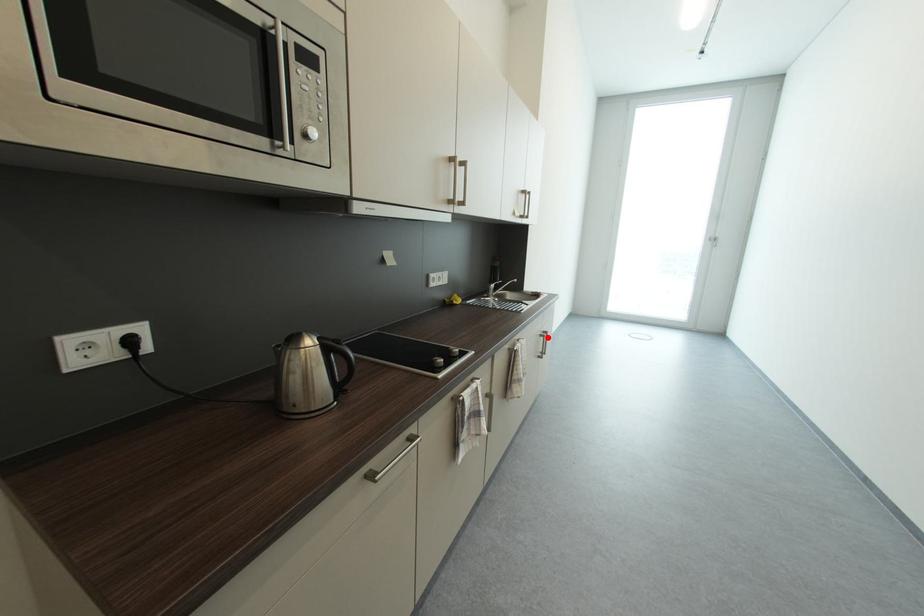
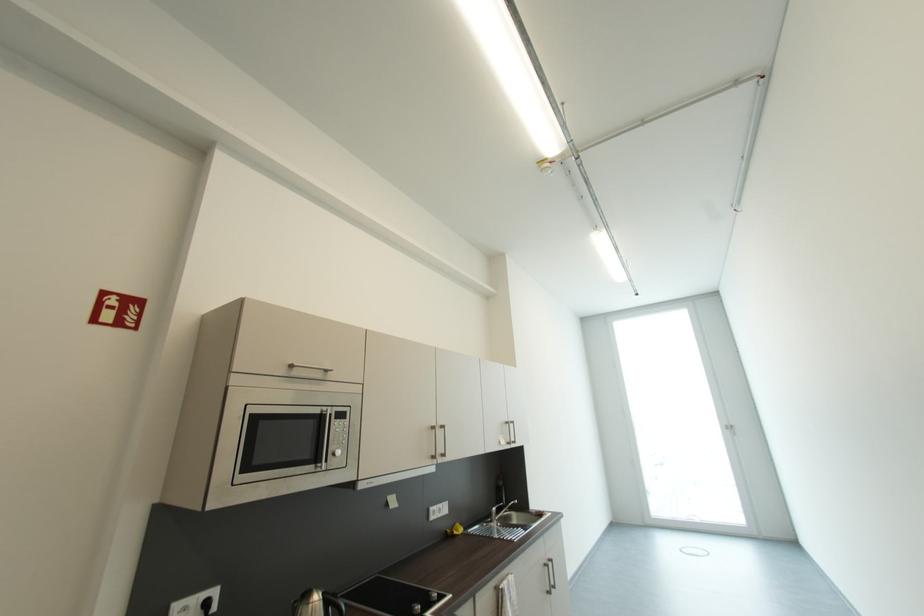
Find the pixel in the second image that matches the highlighted location in the first image.

(552, 567)